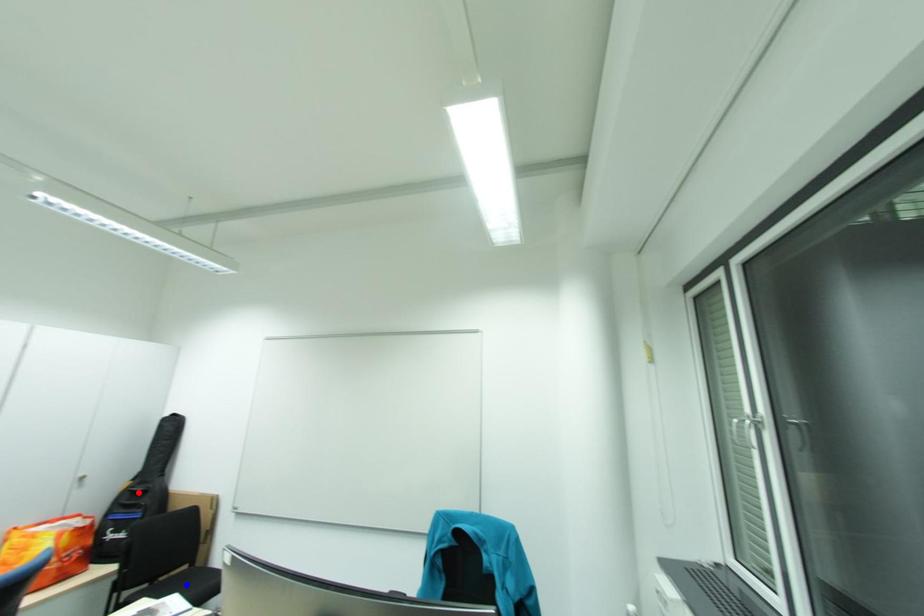
Question: Which of the two points in the image is closer to the camera?

Choices:
 (A) Blue point is closer.
 (B) Red point is closer.

Answer: (A)